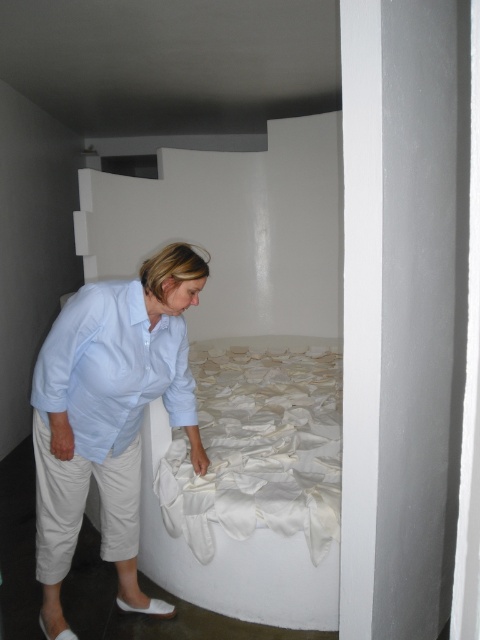
You are a guest in a minimalist room with a white fabric bed at center and a white satin sheet at center. You want to place a small lamp on the side closest to the entrance. Which object should you place it next to?

The white fabric bed at center is to the left of the white satin sheet at center. Since the entrance is typically on the left side of a room, the lamp should be placed next to the white fabric bed at center.

You are a interior designer planning to place a rectangular rug in the center of the room. The rug must fit entirely under both the white fabric bed at center and the white satin sheet at center. Which object will determine the minimum required rug size?

The white fabric bed at center has a larger width than the white satin sheet at center, so the rug must be at least as wide as the white fabric bed at center to accommodate both objects.

You are an interior designer assessing the space. You need to place a new decorative item between the white fabric bed at center and the light blue shirt at center. Which object should the item be placed closer to if it needs to avoid being overshadowed by the larger object?

The new decorative item should be placed closer to the light blue shirt at center because the white fabric bed at center is larger and could overshadow it if placed too near.